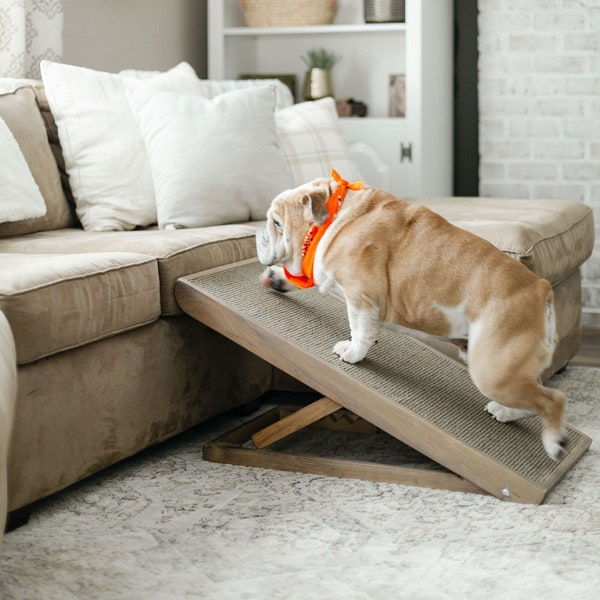
You are a GUI agent. You are given a task and a screenshot of the screen. Output one action in this format:
    pyautogui.click(x=<x>, y=<y>)
    Task: Click on the brick wall
    This screenshot has height=600, width=600.
    Given the screenshot: What is the action you would take?
    pyautogui.click(x=540, y=95)